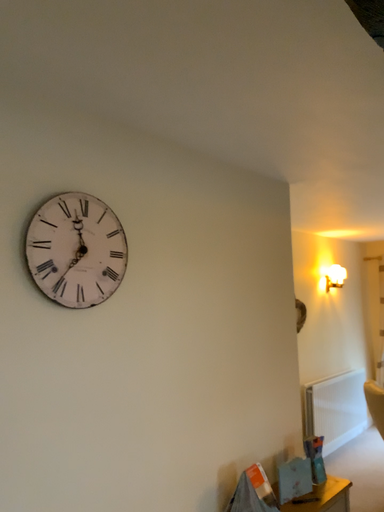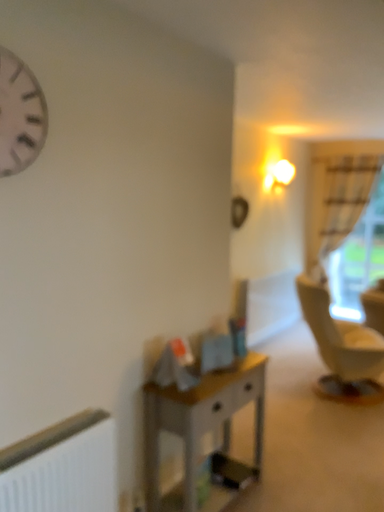
Question: How did the camera likely rotate when shooting the video?

Choices:
 (A) rotated upward
 (B) rotated downward

Answer: (B)